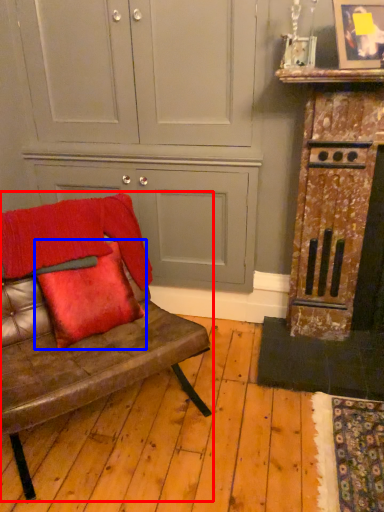
Question: Which of the following is the farthest to the observer, studio couch (highlighted by a red box) or pillow (highlighted by a blue box)?

Choices:
 (A) studio couch
 (B) pillow

Answer: (B)